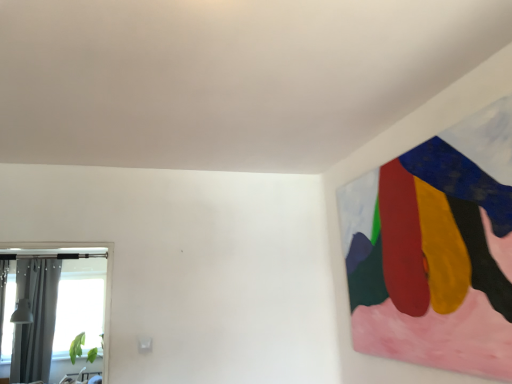
Question: Considering the relative sizes of clear glass window at left and gray fabric curtain at left in the image provided, is clear glass window at left shorter than gray fabric curtain at left?

Choices:
 (A) yes
 (B) no

Answer: (A)

Question: Can you confirm if clear glass window at left is bigger than gray fabric curtain at left?

Choices:
 (A) no
 (B) yes

Answer: (A)

Question: Considering the relative sizes of clear glass window at left and gray fabric curtain at left in the image provided, is clear glass window at left wider than gray fabric curtain at left?

Choices:
 (A) no
 (B) yes

Answer: (B)

Question: Is there a large distance between clear glass window at left and gray fabric curtain at left?

Choices:
 (A) no
 (B) yes

Answer: (A)

Question: From a real-world perspective, is clear glass window at left under gray fabric curtain at left?

Choices:
 (A) yes
 (B) no

Answer: (B)

Question: Is clear glass window at left to the right of gray fabric curtain at left from the viewer's perspective?

Choices:
 (A) no
 (B) yes

Answer: (A)

Question: Is gray fabric curtain at left thinner than clear glass window at left?

Choices:
 (A) no
 (B) yes

Answer: (B)

Question: Can you confirm if gray fabric curtain at left is taller than clear glass window at left?

Choices:
 (A) yes
 (B) no

Answer: (A)

Question: Is gray fabric curtain at left outside of clear glass window at left?

Choices:
 (A) yes
 (B) no

Answer: (A)

Question: Does gray fabric curtain at left appear on the right side of clear glass window at left?

Choices:
 (A) no
 (B) yes

Answer: (B)

Question: Is gray fabric curtain at left in contact with clear glass window at left?

Choices:
 (A) yes
 (B) no

Answer: (B)

Question: Is gray fabric curtain at left positioned with its back to clear glass window at left?

Choices:
 (A) no
 (B) yes

Answer: (A)

Question: Relative to clear glass window at left, is gray fabric curtain at left in front or behind?

Choices:
 (A) behind
 (B) front

Answer: (A)